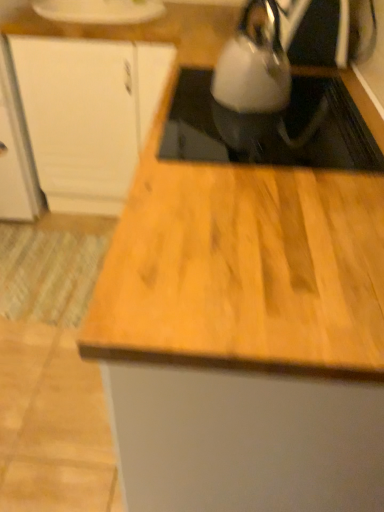
This screenshot has height=512, width=384. I want to click on free space in front of satin silver kettle at upper right, so click(273, 127).